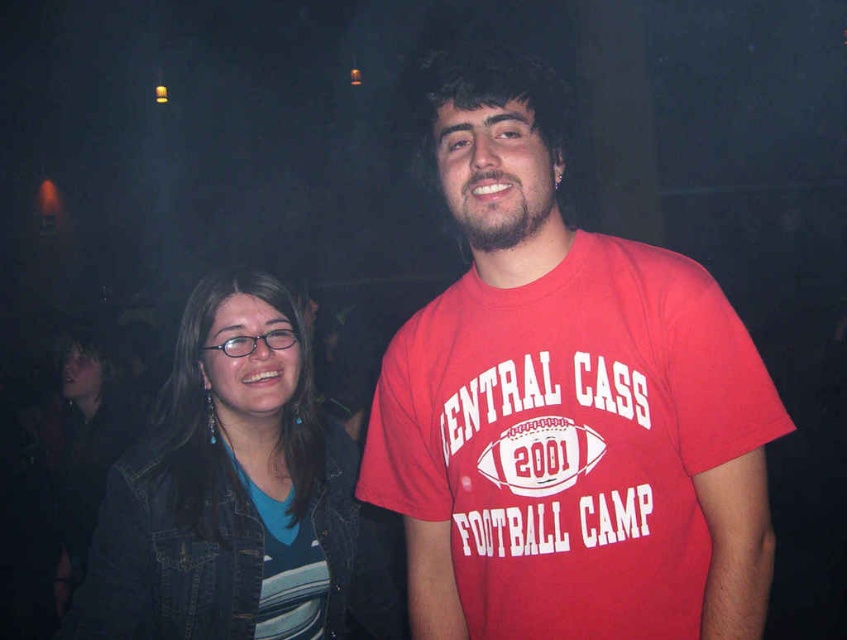
Question: Does red cotton t-shirt at center have a smaller size compared to blue denim jacket at lower left?

Choices:
 (A) no
 (B) yes

Answer: (B)

Question: Considering the relative positions of red cotton t-shirt at center and blue denim jacket at lower left in the image provided, where is red cotton t-shirt at center located with respect to blue denim jacket at lower left?

Choices:
 (A) left
 (B) right

Answer: (B)

Question: Does red cotton t-shirt at center appear over blue denim jacket at lower left?

Choices:
 (A) yes
 (B) no

Answer: (A)